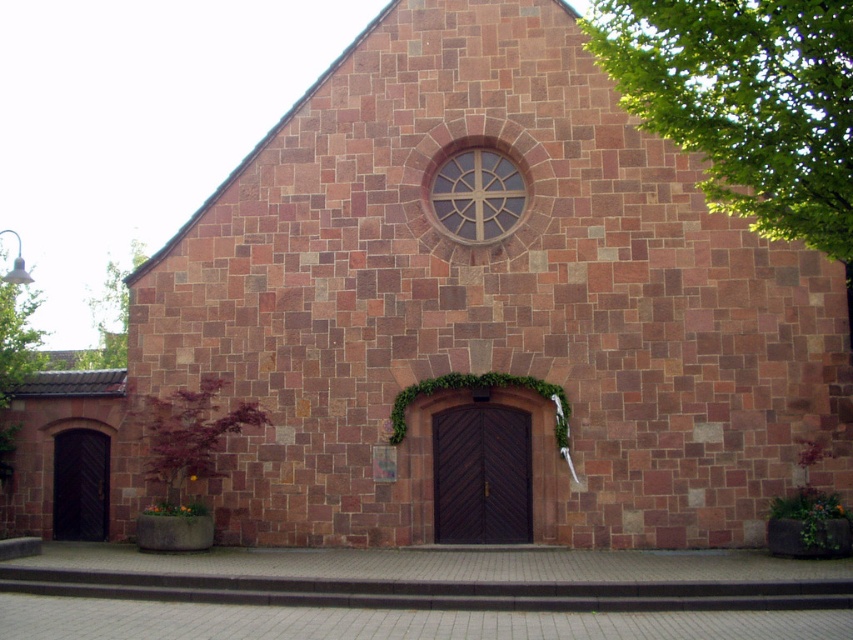
Question: Which point is farther from the camera taking this photo?

Choices:
 (A) (724, 84)
 (B) (140, 422)
 (C) (113, 273)

Answer: (C)

Question: Does green leafy tree at upper right appear on the left side of green leafy tree at upper left?

Choices:
 (A) yes
 (B) no

Answer: (B)

Question: Estimate the real-world distances between objects in this image. Which object is closer to the green leafy tree at upper left?

Choices:
 (A) green leafy tree at upper right
 (B) green leafy ivy at lower left

Answer: (B)

Question: Which of the following is the farthest from the observer?

Choices:
 (A) (102, 356)
 (B) (154, 474)

Answer: (A)

Question: Does green leafy tree at upper right have a larger size compared to green leafy tree at upper left?

Choices:
 (A) no
 (B) yes

Answer: (B)

Question: Is green leafy tree at upper right below green leafy ivy at lower left?

Choices:
 (A) yes
 (B) no

Answer: (B)